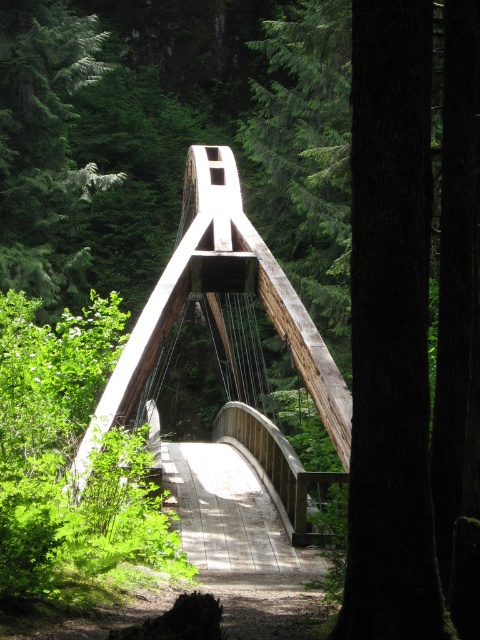
Question: Which object is positioned farthest from the dark brown wood at center?

Choices:
 (A) wooden bridge at center
 (B) green textured tree at center

Answer: (B)

Question: Is wooden bridge at center positioned in front of green textured tree at center?

Choices:
 (A) yes
 (B) no

Answer: (A)

Question: Which object is the closest to the green textured tree at center?

Choices:
 (A) wooden bridge at center
 (B) dark brown wood at center

Answer: (A)

Question: Is dark brown wood at center below wooden bridge at center?

Choices:
 (A) no
 (B) yes

Answer: (B)

Question: Among these objects, which one is farthest from the camera?

Choices:
 (A) green textured tree at center
 (B) wooden bridge at center
 (C) dark brown wood at center

Answer: (A)

Question: Is dark brown wood at center to the left of wooden bridge at center from the viewer's perspective?

Choices:
 (A) yes
 (B) no

Answer: (B)